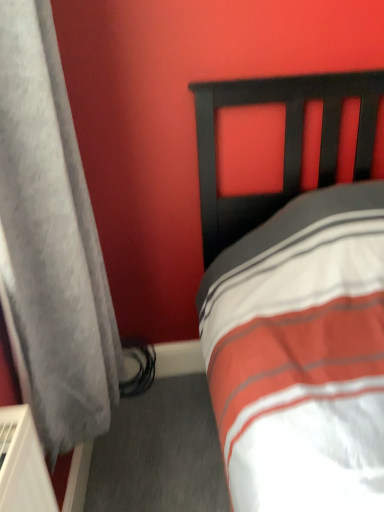
You are a GUI agent. You are given a task and a screenshot of the screen. Output one action in this format:
    pyautogui.click(x=<x>, y=<y>)
    Task: Click on the gray velvety curtain at left
    
    Given the screenshot: What is the action you would take?
    pyautogui.click(x=51, y=242)

What do you see at coordinates (51, 242) in the screenshot? I see `gray velvety curtain at left` at bounding box center [51, 242].

Locate an element on the screen. The image size is (384, 512). gray velvety curtain at left is located at coordinates (51, 242).